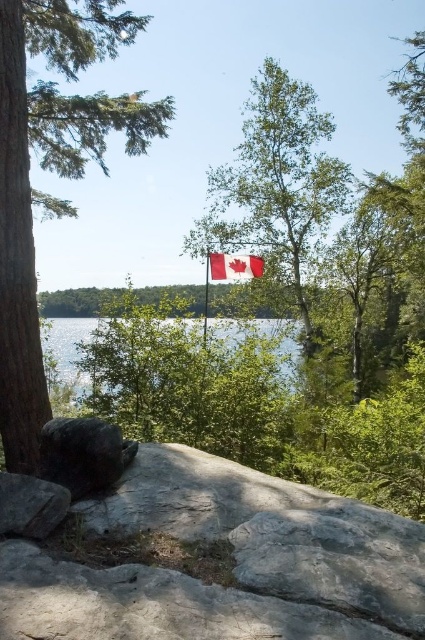
You are a hiker standing at the base of the green textured tree at left and want to take a photo of the red fabric flag at center. Since the tree is blocking your view, can you step to the right to get a clear shot?

The green textured tree at left is much taller than the red fabric flag at center, so stepping to the right might still be blocked by the tree trunk or branches. Find a higher vantage point or move further away to see over the tree.

You are standing in the natural landscape and want to move from the green textured tree at left to the dark gray rock at lower left. Which direction should you move?

To move from the green textured tree at left to the dark gray rock at lower left, you should move to the right since the dark gray rock at lower left is positioned to the right of the green textured tree at left.